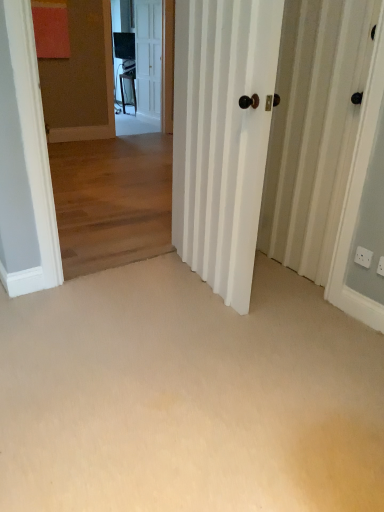
At what (x,y) coordinates should I click in order to perform the action: click on free space in front of white glossy door at center, which appears as the first door when viewed from the right. Please return your answer as a coordinate pair (x, y). This screenshot has width=384, height=512. Looking at the image, I should click on (215, 336).